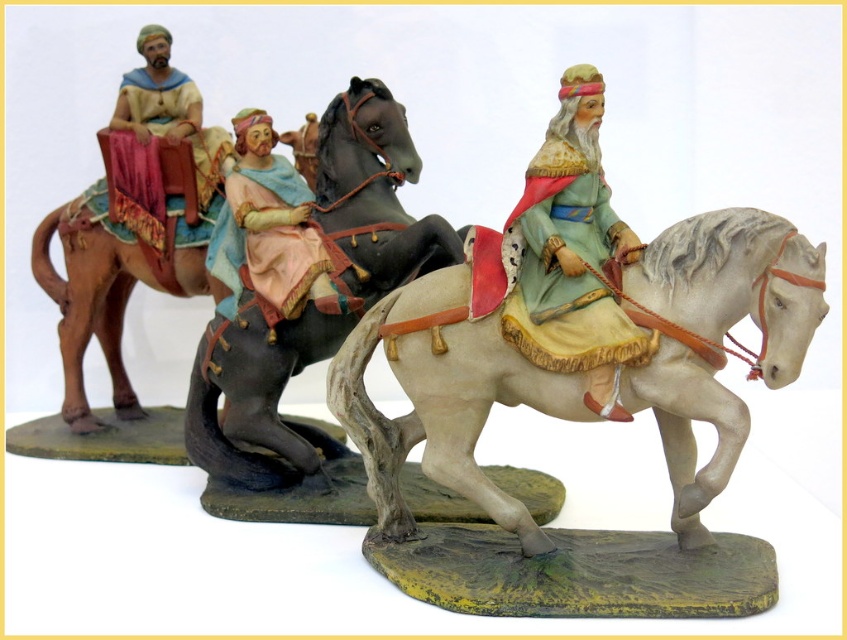
You are a collector who wants to place a new 3.5 inch tall sculpture between the white matte horse at center and the porcelain figure at center. Will there be enough space for the sculpture to fit between them without overlapping either object?

The white matte horse at center and the porcelain figure at center are 2.80 inches apart from each other. Since the sculpture is 3.5 inches tall, it is taller than the available space between them. Therefore, the sculpture will not fit without overlapping the objects.

Based on the scene description, where is the white matte horse at center located in terms of its 2D coordinates?

The white matte horse at center is located at the 2D coordinates point (441, 401).